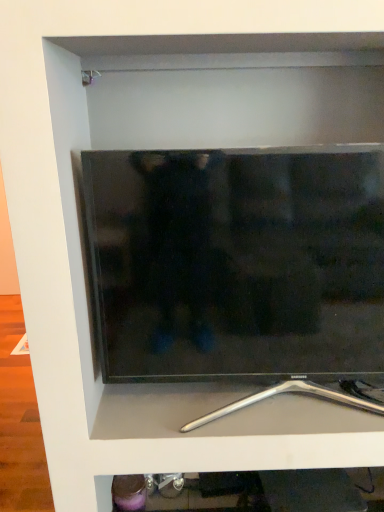
Measure the distance between metallic silver stand at bottom and camera.

metallic silver stand at bottom and camera are 37.80 inches apart.

Image resolution: width=384 pixels, height=512 pixels. Identify the location of metallic silver stand at bottom. (306, 395).

The width and height of the screenshot is (384, 512). What do you see at coordinates (306, 395) in the screenshot? I see `metallic silver stand at bottom` at bounding box center [306, 395].

Identify the location of black glossy tv at center. point(239,265).

This screenshot has height=512, width=384. What do you see at coordinates (239, 265) in the screenshot?
I see `black glossy tv at center` at bounding box center [239, 265].

Locate an element on the screen. metallic silver stand at bottom is located at coordinates (306, 395).

Considering the positions of objects black glossy tv at center and metallic silver stand at bottom in the image provided, who is more to the right, black glossy tv at center or metallic silver stand at bottom?

From the viewer's perspective, metallic silver stand at bottom appears more on the right side.

Is black glossy tv at center behind metallic silver stand at bottom?

No, it is in front of metallic silver stand at bottom.

Is point (271, 234) more distant than point (235, 403)?

That is False.

From the image's perspective, would you say black glossy tv at center is shown under metallic silver stand at bottom?

No.

From a real-world perspective, is black glossy tv at center physically located above or below metallic silver stand at bottom?

Clearly, from a real-world perspective, black glossy tv at center is above metallic silver stand at bottom.

Looking at their sizes, would you say black glossy tv at center is wider or thinner than metallic silver stand at bottom?

In the image, black glossy tv at center appears to be more narrow than metallic silver stand at bottom.

Can you confirm if black glossy tv at center is taller than metallic silver stand at bottom?

Yes.

Considering the sizes of objects black glossy tv at center and metallic silver stand at bottom in the image provided, who is smaller, black glossy tv at center or metallic silver stand at bottom?

Smaller between the two is metallic silver stand at bottom.

Is black glossy tv at center not inside metallic silver stand at bottom?

Absolutely, black glossy tv at center is external to metallic silver stand at bottom.

Is there a large distance between black glossy tv at center and metallic silver stand at bottom?

No, there isn't a large distance between black glossy tv at center and metallic silver stand at bottom.

Is black glossy tv at center facing away from metallic silver stand at bottom?

That's not correct — black glossy tv at center is not looking away from metallic silver stand at bottom.

Where is `television that is above the metallic silver stand at bottom (from the image's perspective)`? This screenshot has width=384, height=512. television that is above the metallic silver stand at bottom (from the image's perspective) is located at coordinates (239, 265).

Between metallic silver stand at bottom and black glossy tv at center, which one appears on the right side from the viewer's perspective?

metallic silver stand at bottom is more to the right.

Relative to black glossy tv at center, is metallic silver stand at bottom in front or behind?

metallic silver stand at bottom is positioned farther from the viewer than black glossy tv at center.

Is point (196, 420) positioned after point (138, 297)?

Yes, it is.

From the image's perspective, which is above, metallic silver stand at bottom or black glossy tv at center?

From the image's view, black glossy tv at center is above.

From a real-world perspective, is metallic silver stand at bottom over black glossy tv at center?

Incorrect, from a real-world perspective, metallic silver stand at bottom is lower than black glossy tv at center.

Based on the photo, which of these two, metallic silver stand at bottom or black glossy tv at center, is wider?

metallic silver stand at bottom.

Can you confirm if metallic silver stand at bottom is shorter than black glossy tv at center?

Indeed, metallic silver stand at bottom has a lesser height compared to black glossy tv at center.

Can you confirm if metallic silver stand at bottom is bigger than black glossy tv at center?

Incorrect, metallic silver stand at bottom is not larger than black glossy tv at center.

Does metallic silver stand at bottom contain black glossy tv at center?

No, black glossy tv at center is not inside metallic silver stand at bottom.

Is metallic silver stand at bottom in contact with black glossy tv at center?

No, metallic silver stand at bottom is not in contact with black glossy tv at center.

Could you tell me if metallic silver stand at bottom is turned towards black glossy tv at center?

Yes.

What's the angular difference between metallic silver stand at bottom and black glossy tv at center's facing directions?

0.0133 degrees.

Locate an element on the screen. silver behind the black glossy tv at center is located at coordinates (306, 395).

At what (x,y) coordinates should I click in order to perform the action: click on silver below the black glossy tv at center (from a real-world perspective). Please return your answer as a coordinate pair (x, y). This screenshot has width=384, height=512. Looking at the image, I should click on (306, 395).

You are a GUI agent. You are given a task and a screenshot of the screen. Output one action in this format:
    pyautogui.click(x=<x>, y=<y>)
    Task: Click on the television that is on the left side of metallic silver stand at bottom
    
    Given the screenshot: What is the action you would take?
    pyautogui.click(x=239, y=265)